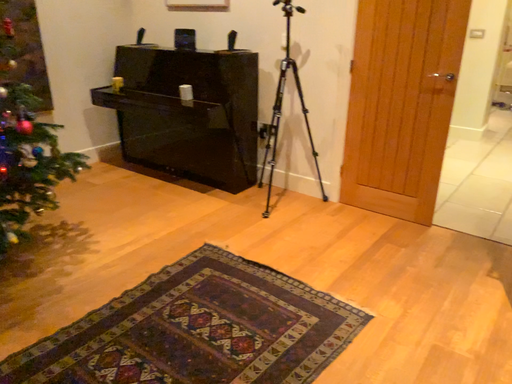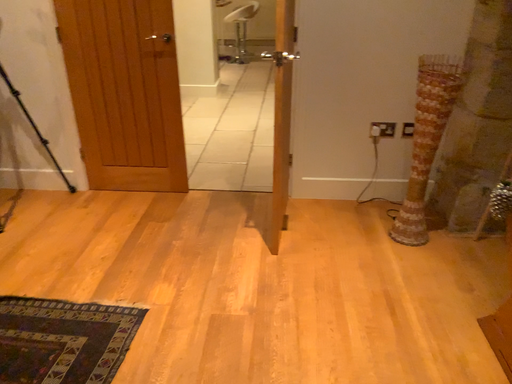
Question: How did the camera likely rotate when shooting the video?

Choices:
 (A) rotated left
 (B) rotated right

Answer: (B)